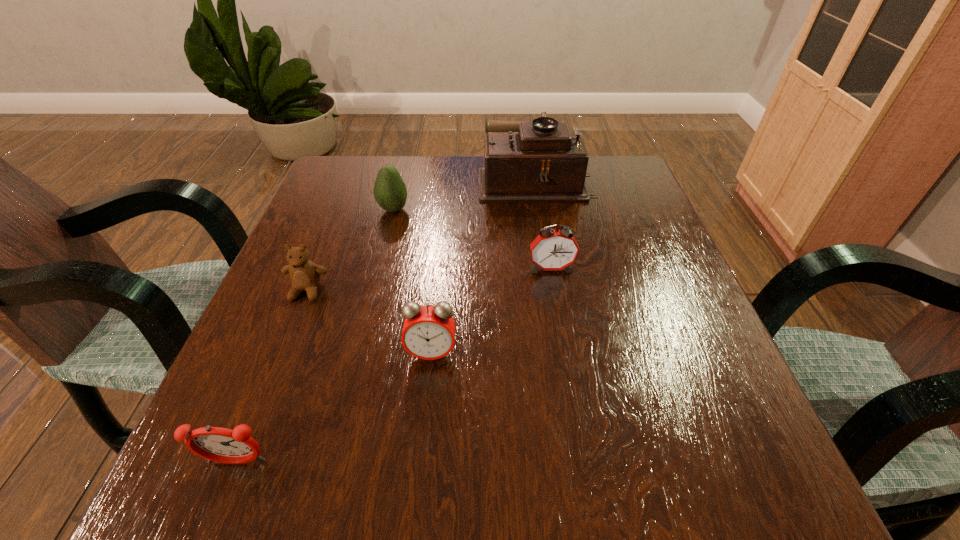
Locate an element on the screen. free location located 0.320m on the horn of the tallest object is located at coordinates (349, 179).

Find the location of a particular element. The image size is (960, 540). vacant space located on the horn of the tallest object is located at coordinates (386, 179).

You are a GUI agent. You are given a task and a screenshot of the screen. Output one action in this format:
    pyautogui.click(x=<x>, y=<y>)
    Task: Click on the vacant area located on the right of the fourth object from right to left
    This screenshot has height=540, width=960.
    Given the screenshot: What is the action you would take?
    pyautogui.click(x=453, y=210)

This screenshot has width=960, height=540. I want to click on free space located on the clock face of the farthest alarm clock, so (x=579, y=433).

The image size is (960, 540). I want to click on free spot located 0.130m on the front-facing side of the third object from right to left, so click(x=422, y=446).

Where is `blank area located 0.150m on the front-facing side of the teddy bear`? The image size is (960, 540). blank area located 0.150m on the front-facing side of the teddy bear is located at coordinates (275, 375).

Where is `phonograph_record present at the far edge`? This screenshot has height=540, width=960. phonograph_record present at the far edge is located at coordinates (540, 161).

The image size is (960, 540). Identify the location of avocado at the far edge. (390, 192).

Locate an element on the screen. This screenshot has width=960, height=540. object that is positioned at the near edge is located at coordinates (217, 444).

The height and width of the screenshot is (540, 960). In order to click on avocado that is at the left edge in this screenshot , I will do `click(390, 192)`.